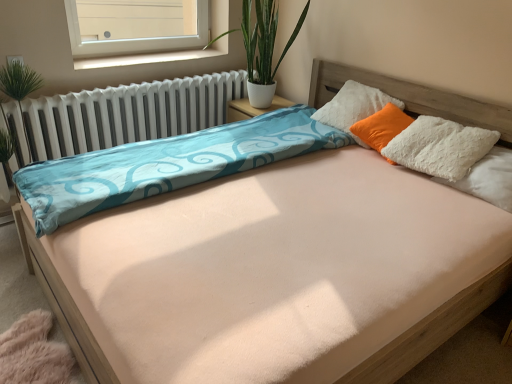
Question: Does white plastic window sill at upper center have a lesser width compared to white metallic radiator at left?

Choices:
 (A) no
 (B) yes

Answer: (B)

Question: Is white plastic window sill at upper center not near white metallic radiator at left?

Choices:
 (A) no
 (B) yes

Answer: (A)

Question: Considering the relative sizes of white plastic window sill at upper center and white metallic radiator at left in the image provided, is white plastic window sill at upper center taller than white metallic radiator at left?

Choices:
 (A) no
 (B) yes

Answer: (A)

Question: Is white plastic window sill at upper center turned away from white metallic radiator at left?

Choices:
 (A) no
 (B) yes

Answer: (A)

Question: Is white plastic window sill at upper center wider than white metallic radiator at left?

Choices:
 (A) yes
 (B) no

Answer: (B)

Question: Considering the relative sizes of white plastic window sill at upper center and white metallic radiator at left in the image provided, is white plastic window sill at upper center bigger than white metallic radiator at left?

Choices:
 (A) yes
 (B) no

Answer: (B)

Question: Is white plastic window at upper left facing towards green leafy plant at upper center?

Choices:
 (A) yes
 (B) no

Answer: (A)

Question: Considering the relative sizes of white plastic window at upper left and green leafy plant at upper center in the image provided, is white plastic window at upper left taller than green leafy plant at upper center?

Choices:
 (A) no
 (B) yes

Answer: (A)

Question: From a real-world perspective, is white plastic window at upper left on top of green leafy plant at upper center?

Choices:
 (A) no
 (B) yes

Answer: (B)

Question: Considering the relative positions of white plastic window at upper left and green leafy plant at upper center in the image provided, is white plastic window at upper left to the right of green leafy plant at upper center from the viewer's perspective?

Choices:
 (A) no
 (B) yes

Answer: (A)

Question: Are white plastic window at upper left and green leafy plant at upper center far apart?

Choices:
 (A) no
 (B) yes

Answer: (B)

Question: Is white plastic window at upper left thinner than green leafy plant at upper center?

Choices:
 (A) yes
 (B) no

Answer: (A)

Question: Considering the relative sizes of white fluffy pillow at upper right, placed as the first pillow when sorted from back to front, and green leafy plant at upper center in the image provided, is white fluffy pillow at upper right, placed as the first pillow when sorted from back to front, thinner than green leafy plant at upper center?

Choices:
 (A) no
 (B) yes

Answer: (B)